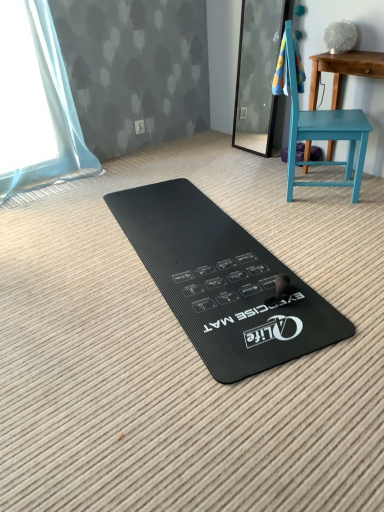
Locate an element on the screen. vacant area situated to the left side of teal matte chair at right is located at coordinates [249, 193].